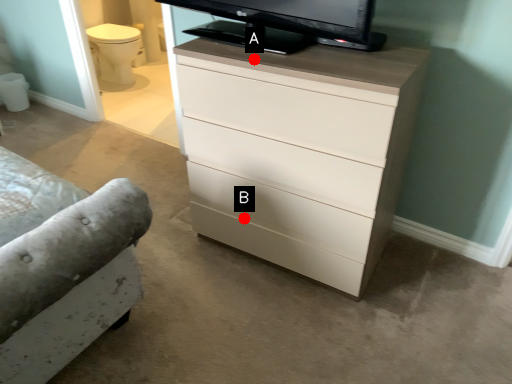
Question: Two points are circled on the image, labeled by A and B beside each circle. Which of the following is the closest to the observer?

Choices:
 (A) A is closer
 (B) B is closer

Answer: (A)